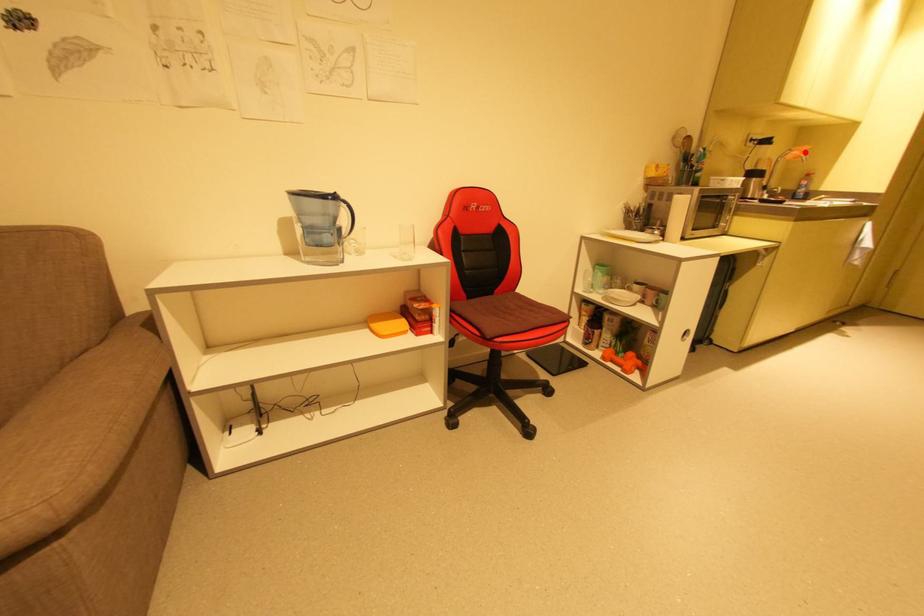
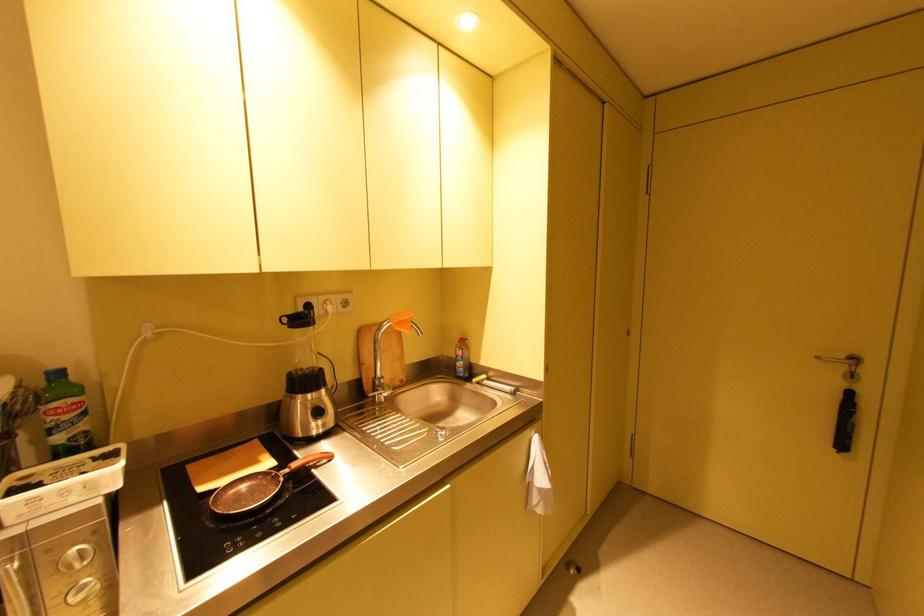
Where in the second image is the point corresponding to the highlighted location from the first image?

(400, 325)